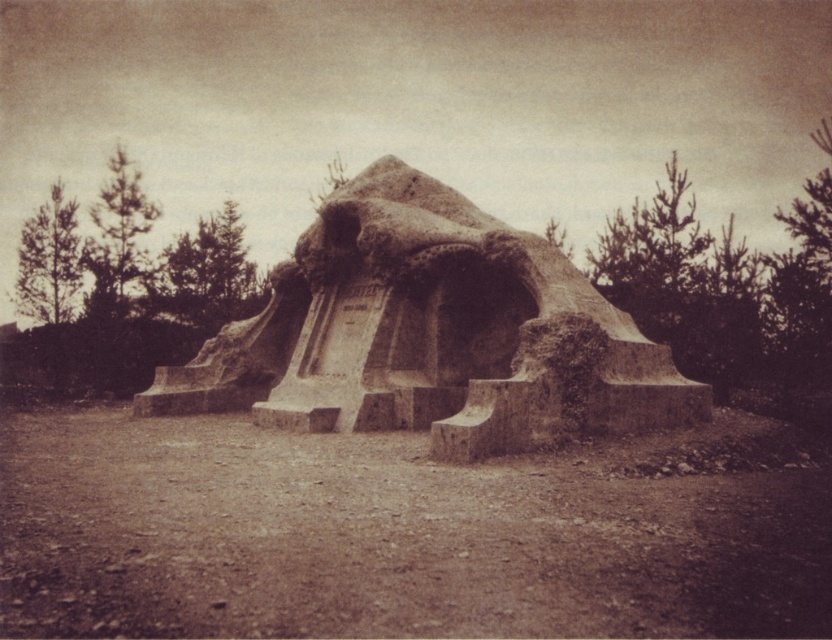
Does brown dirt field at center come in front of rustic stone sculpture at center?

Yes, it is.

Where is `brown dirt field at center`? brown dirt field at center is located at coordinates (394, 536).